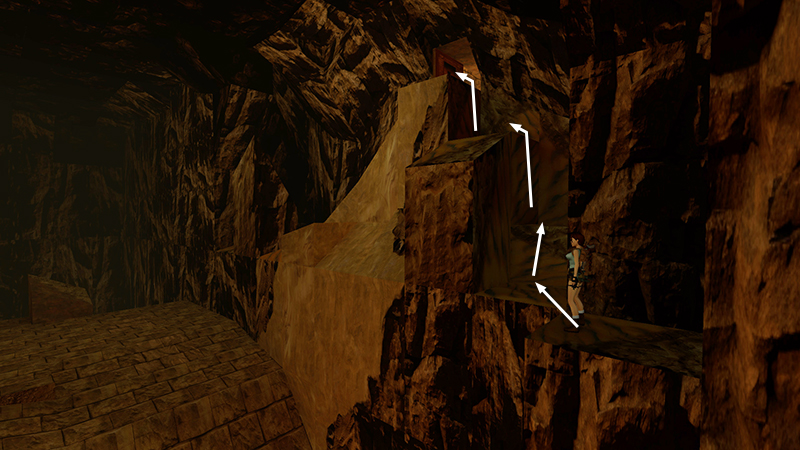
The image size is (800, 450). I want to click on wood structure, so click(x=174, y=371).